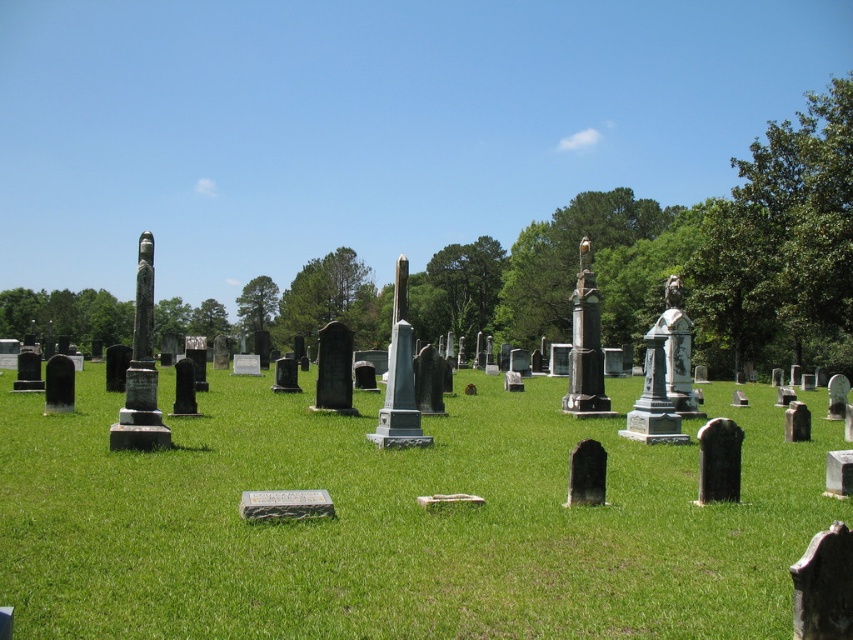
Which of these two, green stone monument at center or polished bronze statue at center-right, stands shorter?

With less height is polished bronze statue at center-right.

Who is more forward, [167,323] or [579,268]?

Point [579,268]

Identify the location of green stone monument at center. (65, 316).

Is green leafy tree at upper right thinner than green leafy tree at center?

No.

What do you see at coordinates (782, 243) in the screenshot? I see `green leafy tree at upper right` at bounding box center [782, 243].

Find the location of a particular element. This screenshot has height=640, width=853. green leafy tree at upper right is located at coordinates (782, 243).

Between green marble monument at center and polished bronze statue at center-right, which one appears on the left side from the viewer's perspective?

green marble monument at center is more to the left.

Between green marble monument at center and polished bronze statue at center-right, which one is positioned higher?

polished bronze statue at center-right

Image resolution: width=853 pixels, height=640 pixels. What are the coordinates of `green marble monument at center` in the screenshot? It's located at (399, 378).